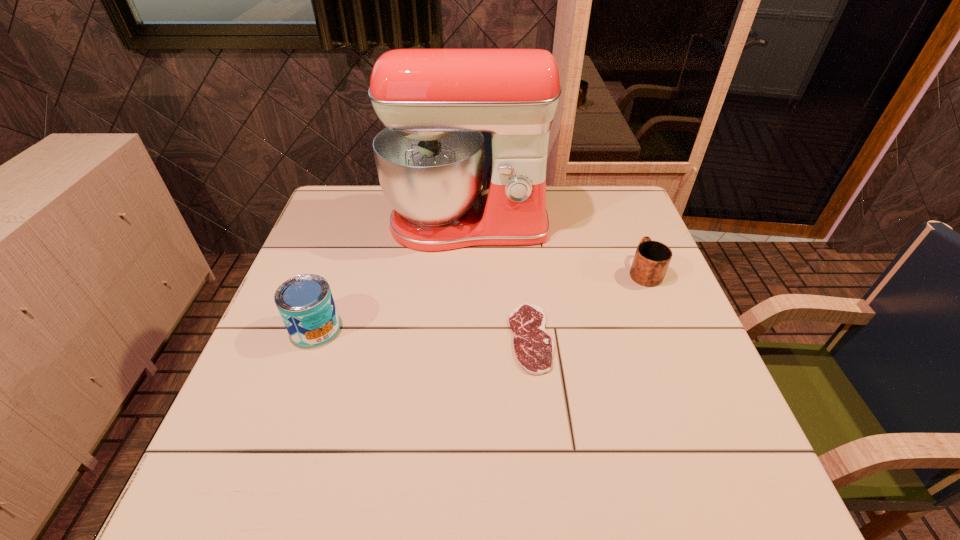
I want to click on free location at the far right corner, so click(635, 216).

What are the coordinates of `vacant space in between the tallest object and the shortest object` in the screenshot? It's located at (499, 281).

I want to click on vacant area between the third tallest object and the second tallest object, so click(x=480, y=299).

Where is `vacant space in between the third shortest object and the steak`? The height and width of the screenshot is (540, 960). vacant space in between the third shortest object and the steak is located at coordinates (423, 333).

At what (x,y) coordinates should I click in order to perform the action: click on free space between the tallest object and the steak. Please return your answer as a coordinate pair (x, y). The width and height of the screenshot is (960, 540). Looking at the image, I should click on (499, 281).

At what (x,y) coordinates should I click in order to perform the action: click on free space between the shortest object and the can. Please return your answer as a coordinate pair (x, y). The height and width of the screenshot is (540, 960). Looking at the image, I should click on (423, 333).

Find the location of `blank region between the third shortest object and the tallest object`. blank region between the third shortest object and the tallest object is located at coordinates (392, 276).

The width and height of the screenshot is (960, 540). What are the coordinates of `vacant space that is in between the steak and the mixer` in the screenshot? It's located at (499, 281).

The image size is (960, 540). In order to click on free spot between the third tallest object and the mixer in this screenshot , I will do `click(556, 247)`.

At what (x,y) coordinates should I click in order to perform the action: click on vacant space in between the mixer and the shortest object. Please return your answer as a coordinate pair (x, y). Looking at the image, I should click on (499, 281).